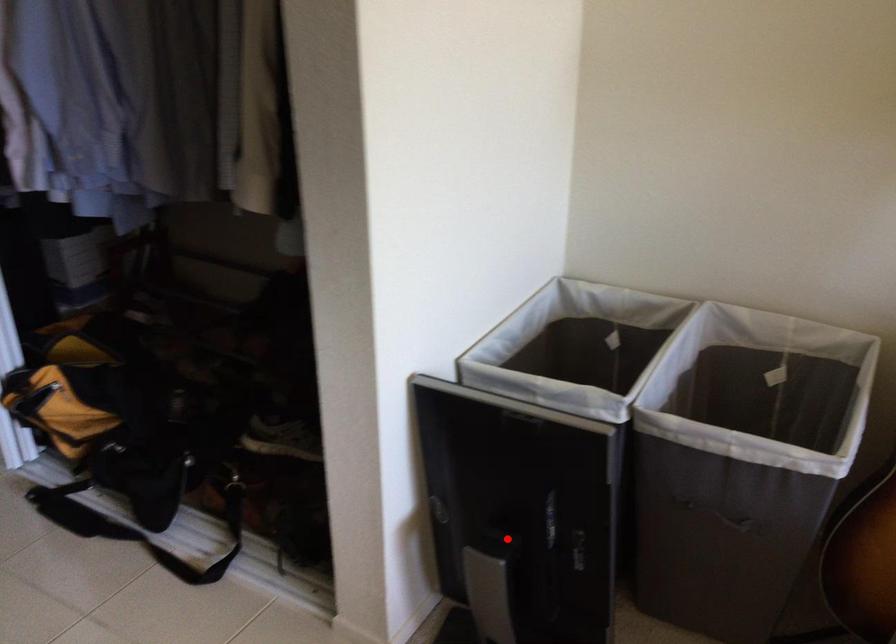
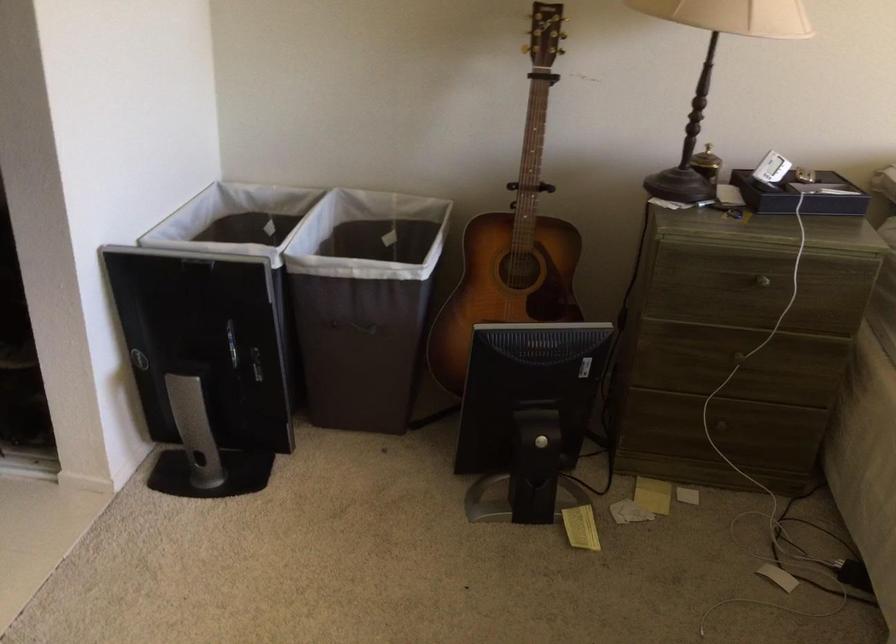
Locate, in the second image, the point that corresponds to the highlighted location in the first image.

(203, 365)